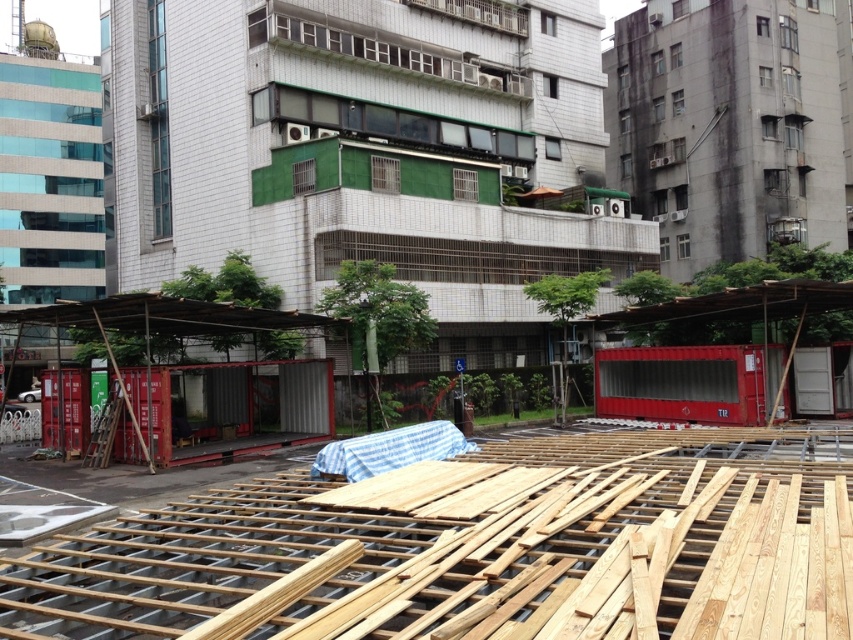
Question: Where is metallic shipping container at center located in relation to natural wood planks at center in the image?

Choices:
 (A) left
 (B) right

Answer: (A)

Question: Does metallic shipping container at center appear under natural wood planks at center?

Choices:
 (A) no
 (B) yes

Answer: (A)

Question: Among these points, which one is farthest from the camera?

Choices:
 (A) pos(270,28)
 (B) pos(427,589)

Answer: (A)

Question: Does metallic shipping container at center have a larger size compared to natural wood planks at center?

Choices:
 (A) yes
 (B) no

Answer: (A)